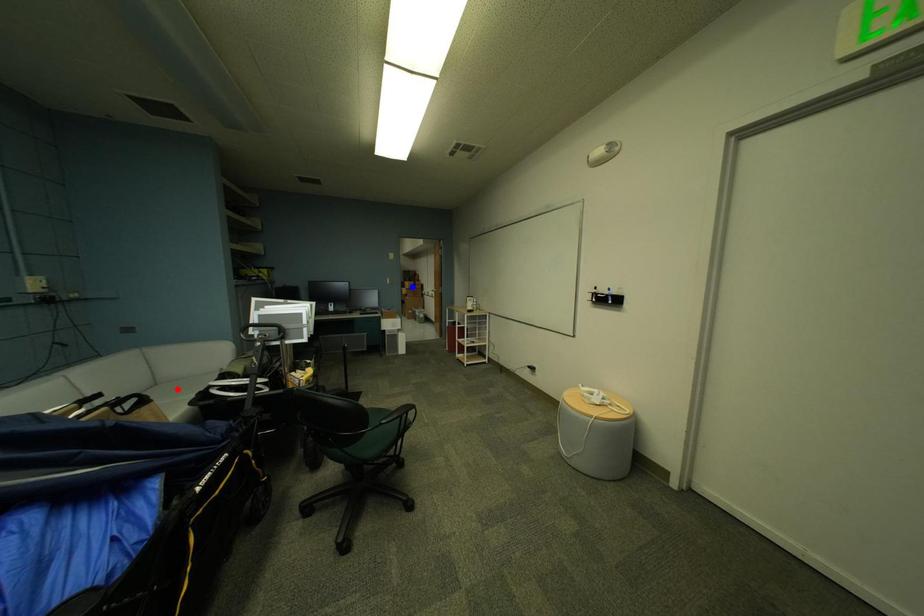
Question: Two points are marked on the image. Which point is closer to the camera?

Choices:
 (A) Blue point is closer.
 (B) Red point is closer.

Answer: (B)